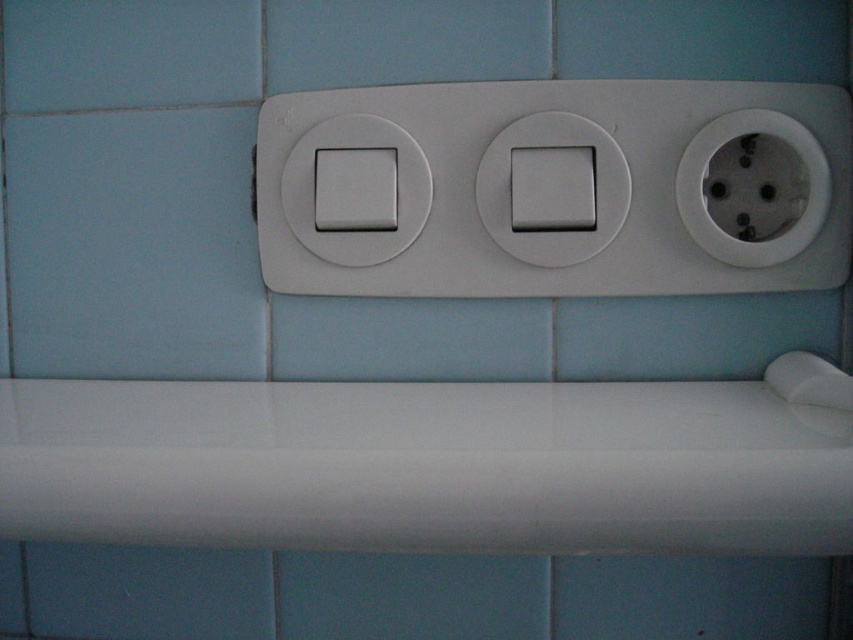
Based on the photo, is white plastic light switch at center bigger than white plastic socket at right?

Indeed, white plastic light switch at center has a larger size compared to white plastic socket at right.

Between point (728, 273) and point (799, 228), which one is positioned behind?

Positioned behind is point (728, 273).

Between point (840, 260) and point (769, 246), which one is positioned in front?

Point (769, 246)

The image size is (853, 640). Identify the location of white plastic light switch at center. (625, 200).

Consider the image. Between blue matte tile at lower center and white plastic socket at right, which one is positioned lower?

blue matte tile at lower center

In the scene shown: Is blue matte tile at lower center positioned at the back of white plastic socket at right?

Yes, it is behind white plastic socket at right.

Image resolution: width=853 pixels, height=640 pixels. Describe the element at coordinates (410, 596) in the screenshot. I see `blue matte tile at lower center` at that location.

The height and width of the screenshot is (640, 853). What are the coordinates of `blue matte tile at lower center` in the screenshot? It's located at (410, 596).

Consider the image. Does white plastic light switch at center appear on the right side of blue matte tile at lower center?

Correct, you'll find white plastic light switch at center to the right of blue matte tile at lower center.

You are a GUI agent. You are given a task and a screenshot of the screen. Output one action in this format:
    pyautogui.click(x=<x>, y=<y>)
    Task: Click on the white plastic light switch at center
    This screenshot has width=853, height=640.
    Given the screenshot: What is the action you would take?
    pyautogui.click(x=625, y=200)

You are a GUI agent. You are given a task and a screenshot of the screen. Output one action in this format:
    pyautogui.click(x=<x>, y=<y>)
    Task: Click on the white plastic light switch at center
    This screenshot has height=640, width=853.
    Given the screenshot: What is the action you would take?
    coord(625,200)